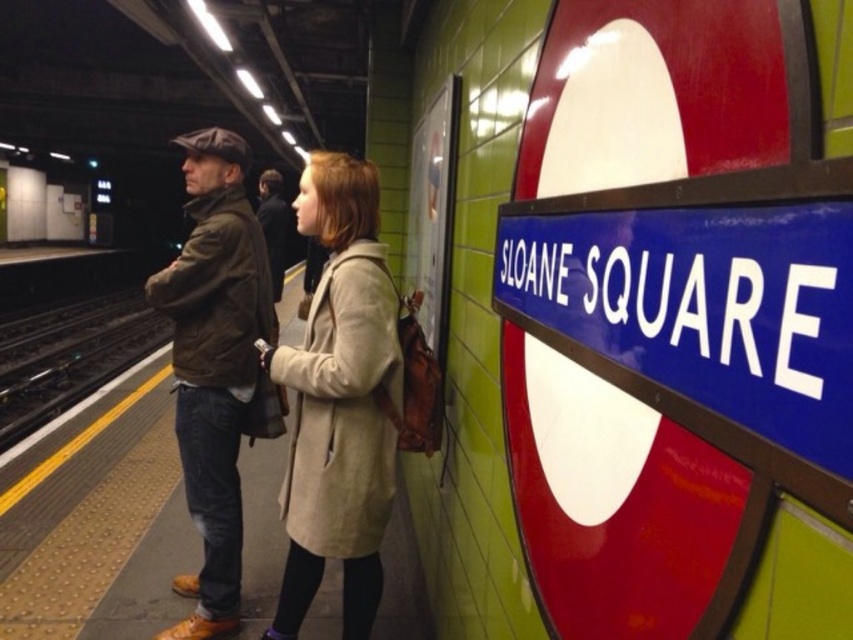
Based on the photo, you are standing on the platform at Sloane Square station and want to check if your 1.8 meters long skateboard can fit between you and the brown leather jacket at center without touching it. Can it fit?

The distance between you and the brown leather jacket at center is 2.31 meters. Since your skateboard is 1.8 meters long, there is enough space for it to fit without touching the jacket.

You are a pedestrian trying to cross the black metal train track at left near the dark brown leather jacket at center. Can you estimate if the jacket will fit through the space between the track and the platform edge?

The black metal train track at left might be wider than dark brown leather jacket at center, so there is a possibility that the jacket may not fit through the space. It is safer to choose another path or consult station staff for assistance.